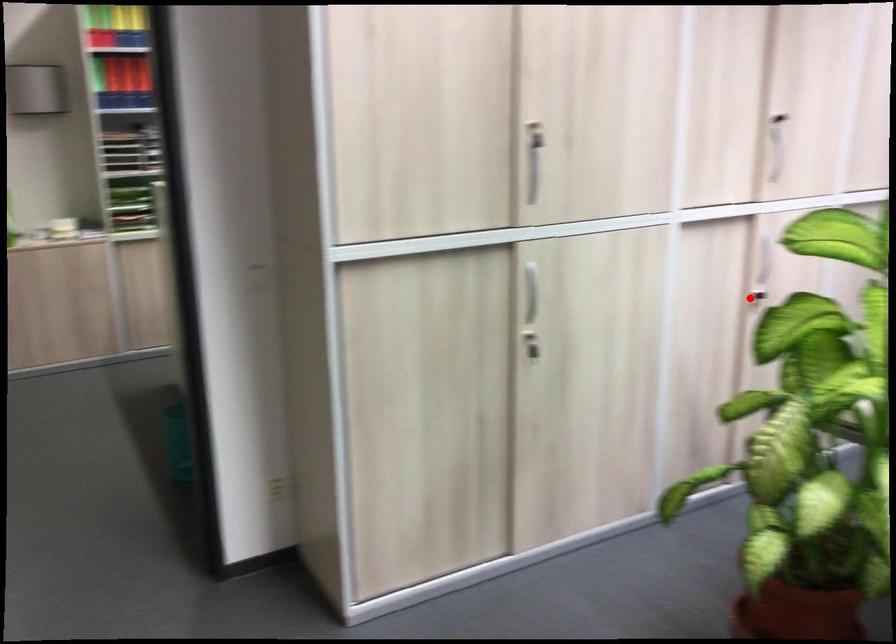
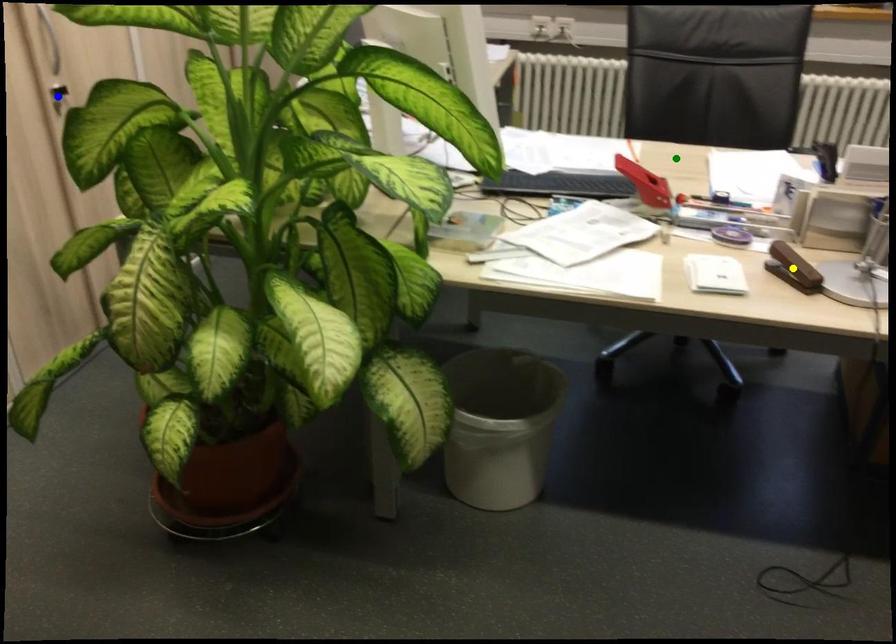
Question: I am providing you with two images of the same scene from different viewpoints. A red point is marked on the first image. You are given multiple points on the second image. Which point in image 2 is actually the same real-world point as the red point in image 1?

Choices:
 (A) yellow point
 (B) green point
 (C) blue point

Answer: (C)